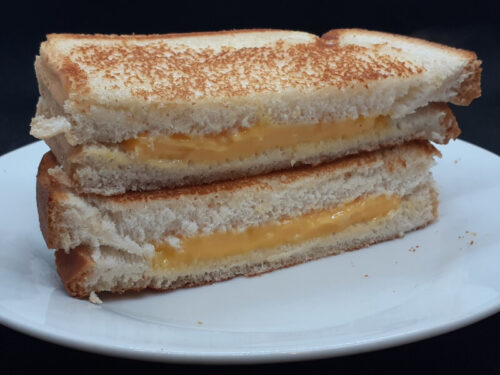
Locate an element on the screen. plate is located at coordinates (378, 275).